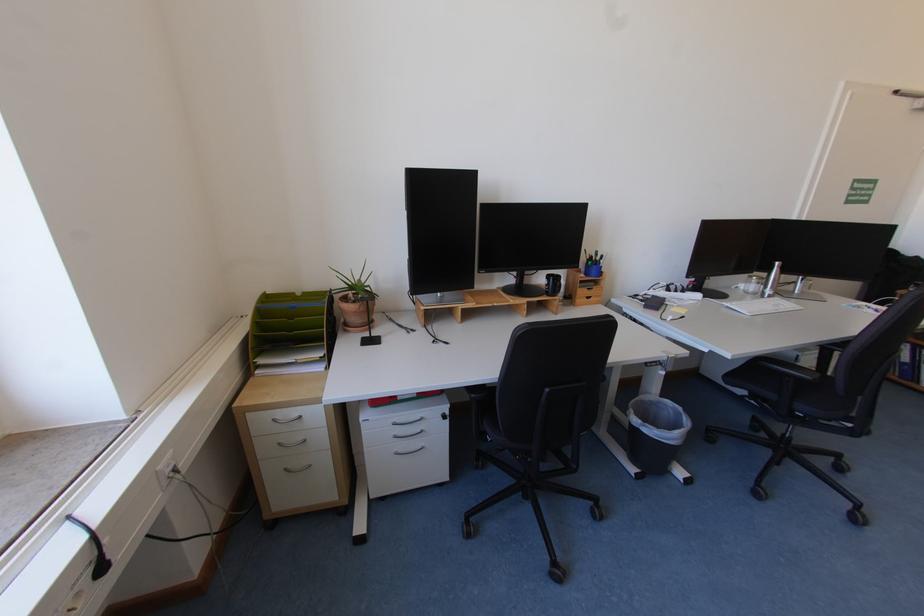
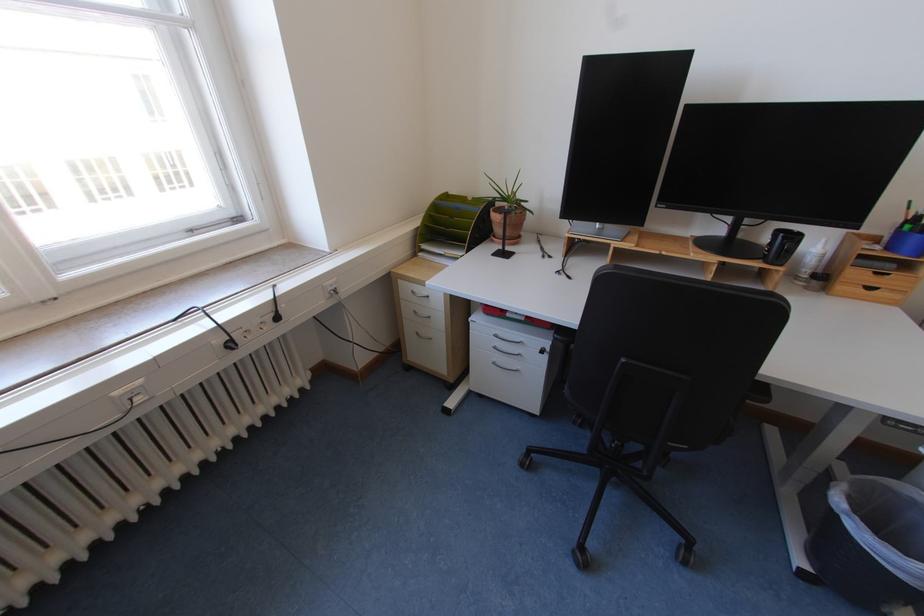
Where in the second image is the point corresponding to point 311,294 from the first image?

(481, 199)